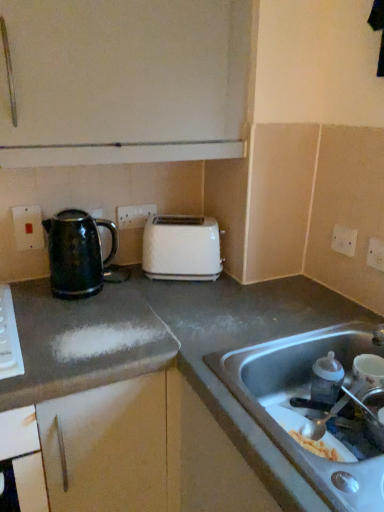
What are the coordinates of `free space above gray matte countertop at center, the second countertop positioned from the left (from a real-world perspective)` in the screenshot? It's located at (251, 310).